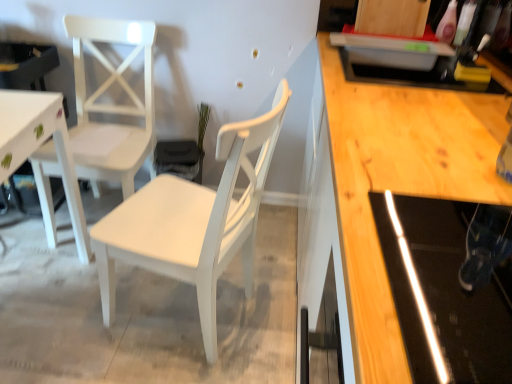
Locate an element on the screen. vacant space in white painted wood chair at center, marked as the second chair in a left-to-right arrangement (from a real-world perspective) is located at coordinates (x=196, y=307).